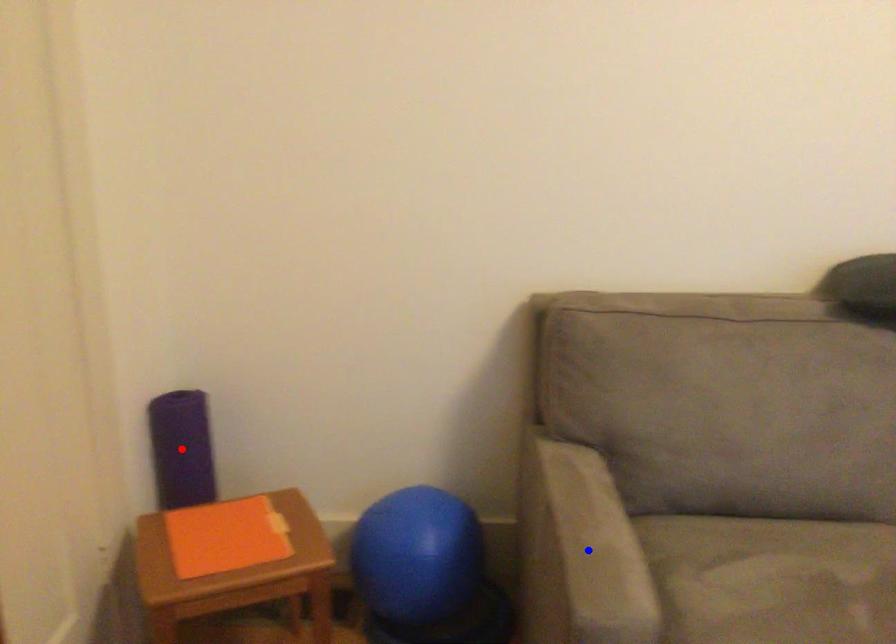
Question: Which of the two points in the image is closer to the camera?

Choices:
 (A) Blue point is closer.
 (B) Red point is closer.

Answer: (A)